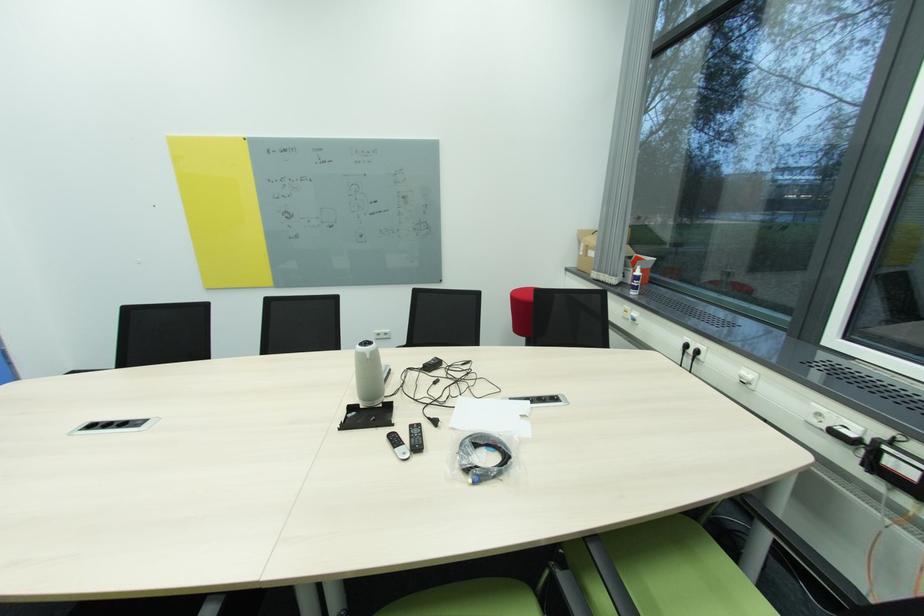
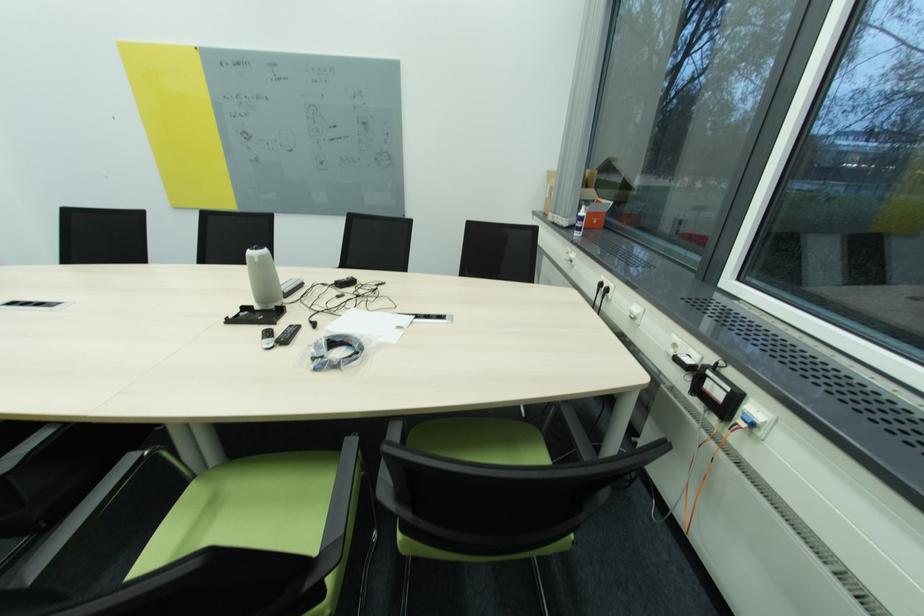
The point at (476, 450) is marked in the first image. Where is the corresponding point in the second image?

(327, 345)